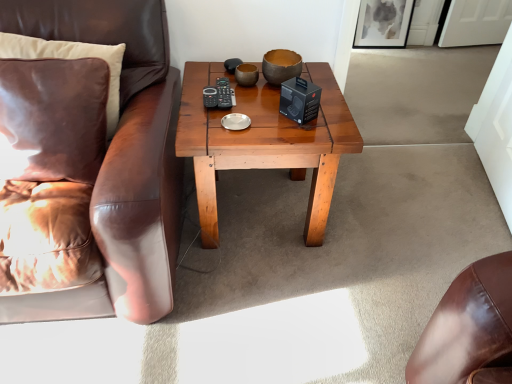
Measure the distance between velvet brown pillow at left, arranged as the 1th pillow when viewed from the front, and camera.

The depth of velvet brown pillow at left, arranged as the 1th pillow when viewed from the front, is 4.11 feet.

Locate an element on the screen. This screenshot has height=384, width=512. matte gray painting at upper right is located at coordinates (383, 23).

Measure the distance between matte gray painting at upper right and camera.

A distance of 3.06 meters exists between matte gray painting at upper right and camera.

Where is `brown leather chair at left`? This screenshot has width=512, height=384. brown leather chair at left is located at coordinates (93, 166).

From a real-world perspective, who is located lower, matte brown bowl at center or brown leather chair at left?

brown leather chair at left, from a real-world perspective.

Considering the points (282, 65) and (18, 10), which point is in front, point (282, 65) or point (18, 10)?

The point (18, 10) is in front.

Between matte brown bowl at center and brown leather chair at left, which one has more height?

With more height is brown leather chair at left.

Between matte brown bowl at center and brown leather chair at left, which one has larger width?

With larger width is brown leather chair at left.

Consider the image. Is wooden coffee table at center aimed at brown leather chair at left?

No, wooden coffee table at center is not oriented towards brown leather chair at left.

Looking at the image, does wooden coffee table at center seem bigger or smaller compared to brown leather chair at left?

Considering their sizes, wooden coffee table at center takes up less space than brown leather chair at left.

In the image, is wooden coffee table at center positioned in front of or behind brown leather chair at left?

wooden coffee table at center is positioned farther from the viewer than brown leather chair at left.

Which point is more distant from viewer, (3,102) or (245,166)?

The point (245,166) is farther from the camera.

Is velvet brown pillow at left, arranged as the 1th pillow when viewed from the front, completely or partially outside of wooden coffee table at center?

Indeed, velvet brown pillow at left, arranged as the 1th pillow when viewed from the front, is completely outside wooden coffee table at center.

Does velvet brown pillow at left, arranged as the 1th pillow when viewed from the front, turn towards wooden coffee table at center?

No, velvet brown pillow at left, arranged as the 1th pillow when viewed from the front, is not oriented towards wooden coffee table at center.

Does brown leather chair at left turn towards matte gray painting at upper right?

No, brown leather chair at left is not turned towards matte gray painting at upper right.

Considering the sizes of objects brown leather chair at left and matte gray painting at upper right in the image provided, who is shorter, brown leather chair at left or matte gray painting at upper right?

With less height is matte gray painting at upper right.

Can you confirm if brown leather chair at left is smaller than matte gray painting at upper right?

No.

Looking at this image, which object is positioned more to the right, brown leather chair at left or matte gray painting at upper right?

matte gray painting at upper right is more to the right.

From the image's perspective, does matte brown bowl at center appear lower than wooden coffee table at center?

Incorrect, from the image's perspective, matte brown bowl at center is higher than wooden coffee table at center.

Is matte brown bowl at center positioned far away from wooden coffee table at center?

No.

Is wooden coffee table at center at the back of matte brown bowl at center?

matte brown bowl at center is not turned away from wooden coffee table at center.

Measure the distance between matte brown bowl at center and wooden coffee table at center.

28.26 centimeters.

Which is less distant, (142, 8) or (106, 118)?

Result: Point (106, 118)

Can you confirm if brown leather chair at left is wider than suede pillow at left, which ranks as the 2th pillow in front-to-back order?

Yes, brown leather chair at left is wider than suede pillow at left, which ranks as the 2th pillow in front-to-back order.

Can you confirm if brown leather chair at left is taller than suede pillow at left, marked as the 1th pillow in a back-to-front arrangement?

Yes.

Is the position of velvet brown pillow at left, arranged as the 1th pillow when viewed from the front, less distant than that of matte brown bowl at center?

Yes, velvet brown pillow at left, arranged as the 1th pillow when viewed from the front, is closer to the camera.

Measure the distance between velvet brown pillow at left, which ranks as the second pillow in back-to-front order, and matte brown bowl at center.

The distance of velvet brown pillow at left, which ranks as the second pillow in back-to-front order, from matte brown bowl at center is 28.79 inches.

From a real-world perspective, between velvet brown pillow at left, which ranks as the second pillow in back-to-front order, and matte brown bowl at center, who is vertically higher?

From a 3D spatial view, matte brown bowl at center is above.

Find the location of a particular element. The image size is (512, 384). chair below the matte brown bowl at center (from the image's perspective) is located at coordinates (93, 166).

Where is `coffee table located behind the brown leather chair at left`? This screenshot has height=384, width=512. coffee table located behind the brown leather chair at left is located at coordinates (264, 142).

When comparing their distances from wooden coffee table at center, does matte gray painting at upper right or matte brown bowl at center seem further?

Among the two, matte gray painting at upper right is located further to wooden coffee table at center.

Looking at the image, which one is located further to matte gray painting at upper right, suede pillow at left, marked as the 1th pillow in a back-to-front arrangement, or matte brown bowl at center?

suede pillow at left, marked as the 1th pillow in a back-to-front arrangement, is positioned further to the anchor matte gray painting at upper right.

In the scene shown: Considering their positions, is matte brown bowl at center positioned further to matte gray painting at upper right than velvet brown pillow at left, arranged as the 1th pillow when viewed from the front?

Among the two, velvet brown pillow at left, arranged as the 1th pillow when viewed from the front, is located further to matte gray painting at upper right.

From the image, which object appears to be farther from matte gray painting at upper right, suede pillow at left, which ranks as the 2th pillow in front-to-back order, or velvet brown pillow at left, which ranks as the second pillow in back-to-front order?

The object further to matte gray painting at upper right is velvet brown pillow at left, which ranks as the second pillow in back-to-front order.

Consider the image. Which object lies further to the anchor point matte brown bowl at center, velvet brown pillow at left, arranged as the 1th pillow when viewed from the front, or suede pillow at left, which ranks as the 2th pillow in front-to-back order?

Based on the image, velvet brown pillow at left, arranged as the 1th pillow when viewed from the front, appears to be further to matte brown bowl at center.

Looking at the image, which one is located further to suede pillow at left, marked as the 1th pillow in a back-to-front arrangement, brown leather chair at left or matte gray painting at upper right?

matte gray painting at upper right.

Considering their positions, is suede pillow at left, marked as the 1th pillow in a back-to-front arrangement, positioned further to brown leather chair at left than matte brown bowl at center?

Based on the image, matte brown bowl at center appears to be further to brown leather chair at left.

When comparing their distances from matte brown bowl at center, does velvet brown pillow at left, which ranks as the second pillow in back-to-front order, or brown leather chair at left seem further?

velvet brown pillow at left, which ranks as the second pillow in back-to-front order, lies further to matte brown bowl at center than the other object.

Where is `bowl between velvet brown pillow at left, arranged as the 1th pillow when viewed from the front, and matte gray painting at upper right in the front-back direction`? bowl between velvet brown pillow at left, arranged as the 1th pillow when viewed from the front, and matte gray painting at upper right in the front-back direction is located at coordinates click(x=281, y=66).

Where is `coffee table between brown leather chair at left and matte gray painting at upper right along the z-axis`? Image resolution: width=512 pixels, height=384 pixels. coffee table between brown leather chair at left and matte gray painting at upper right along the z-axis is located at coordinates (264, 142).

You are a GUI agent. You are given a task and a screenshot of the screen. Output one action in this format:
    pyautogui.click(x=<x>, y=<y>)
    Task: Click on the pillow positioned between velvet brown pillow at left, which ranks as the second pillow in back-to-front order, and matte gray painting at upper right from near to far
    
    Given the screenshot: What is the action you would take?
    pyautogui.click(x=70, y=59)

Image resolution: width=512 pixels, height=384 pixels. I want to click on coffee table positioned between suede pillow at left, marked as the 1th pillow in a back-to-front arrangement, and matte gray painting at upper right from near to far, so click(264, 142).